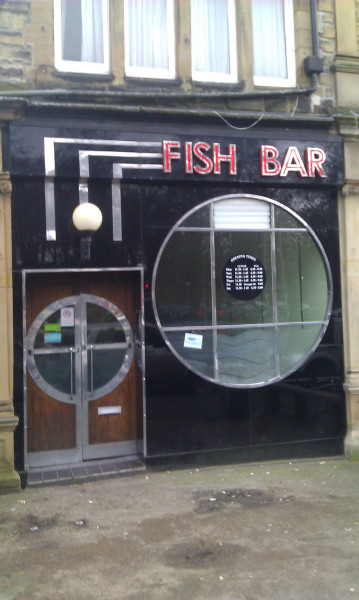
This screenshot has width=359, height=600. What are the coordinates of `white lamp` in the screenshot? It's located at (85, 216).